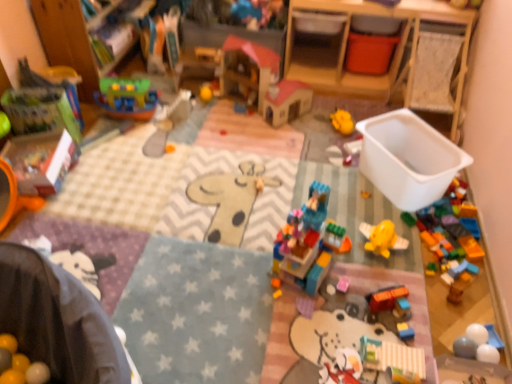
What are the coordinates of `unoccupied area behind yellow matte ball at center, acting as the 3th toy starting from the top` in the screenshot? It's located at (197, 85).